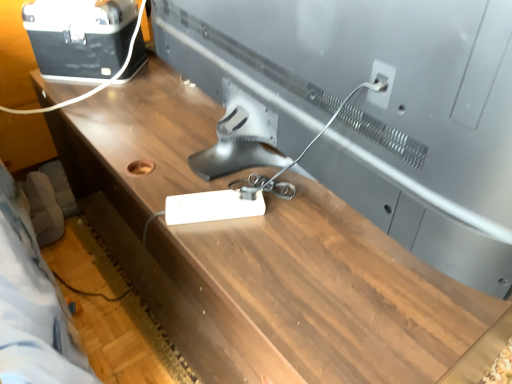
Measure the distance between point (108, 61) and camera.

Point (108, 61) and camera are 1.30 meters apart from each other.

The height and width of the screenshot is (384, 512). Identify the location of matte black speaker at upper left. (80, 36).

This screenshot has width=512, height=384. Describe the element at coordinates (80, 36) in the screenshot. I see `matte black speaker at upper left` at that location.

Identify the location of matte black speaker at upper left. The height and width of the screenshot is (384, 512). (80, 36).